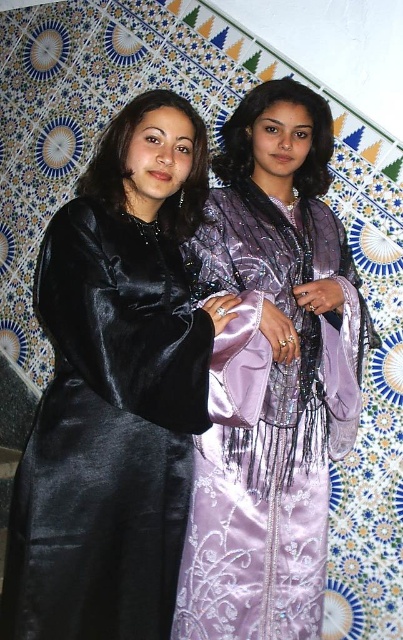
You are a photographer setting up for a photoshoot. You need to position the matte black dress at left and the lavender satin dress at center so that both are visible in the frame. Given their sizes, which dress should be placed closer to the camera to ensure both are fully visible?

The matte black dress at left is larger in size than the lavender satin dress at center. To ensure both are fully visible in the frame, the lavender satin dress at center should be placed closer to the camera since it is smaller, allowing the larger matte black dress at left to be positioned slightly farther back without being cropped out.

Based on the photo, you are a photographer setting up for a photoshoot. You need to position the two dresses so that they fit within a 2.5 meter wide backdrop. Given that the matte black dress at left is wider than the lavender satin dress at center, can both dresses fit side by side without overlapping?

The matte black dress at left is wider than the lavender satin dress at center. To determine if both can fit side by side within the 2.5 meter backdrop, we need to know their exact widths. However, since the problem only states that the matte black dress is wider than the lavender one but doesn

What is located at the coordinates point (114, 388)?

The point (114, 388) is where the matte black dress at left is located.